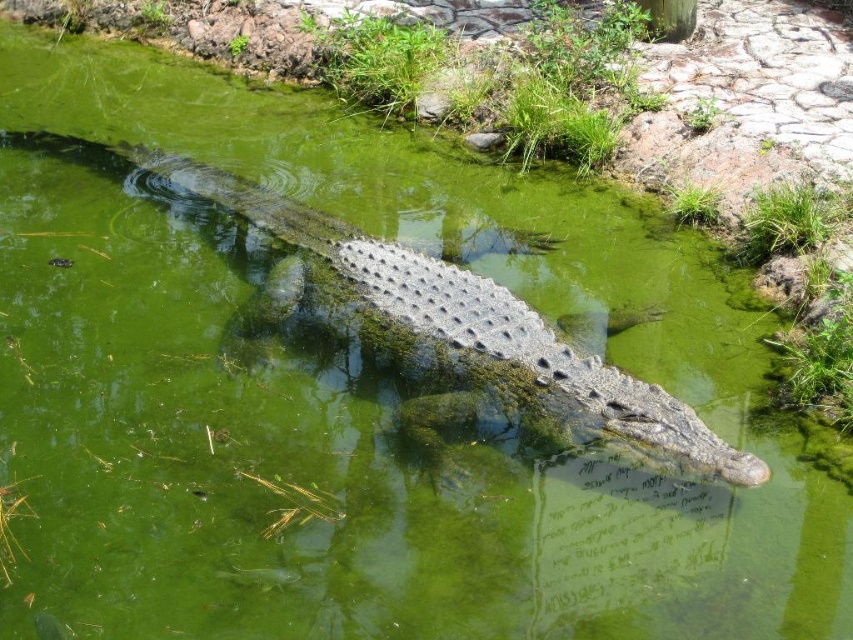
Does gray scaly crocodile at center have a smaller size compared to green grass at upper right?

No, gray scaly crocodile at center is not smaller than green grass at upper right.

Between point (219, 180) and point (781, 244), which one is positioned in front?

Point (781, 244) is more forward.

Image resolution: width=853 pixels, height=640 pixels. I want to click on gray scaly crocodile at center, so click(x=471, y=317).